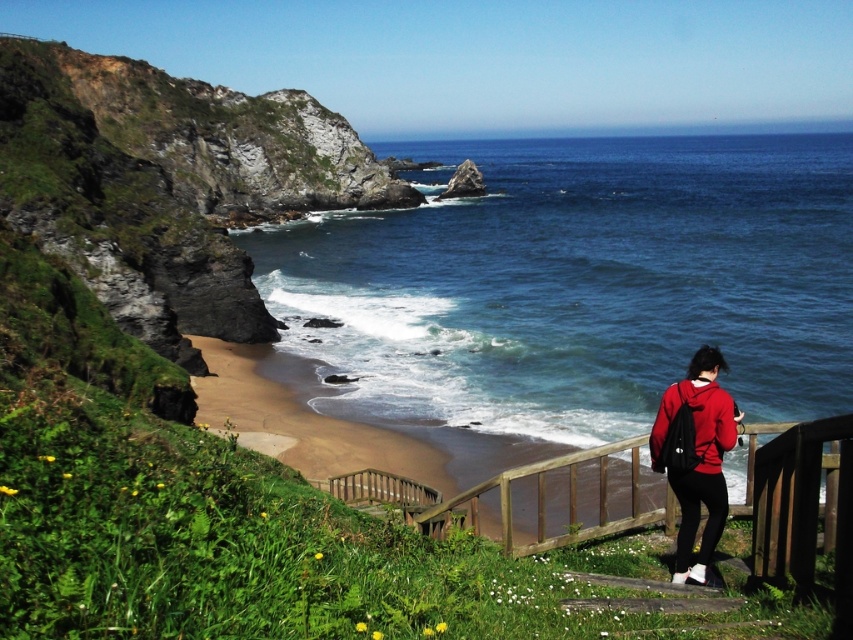
Question: Does wooden at lower right appear on the left side of matte red jacket at lower right?

Choices:
 (A) no
 (B) yes

Answer: (A)

Question: Does red matte jacket at lower right have a smaller size compared to wooden at lower right?

Choices:
 (A) yes
 (B) no

Answer: (A)

Question: Can you confirm if blue water at center is wider than red matte jacket at lower right?

Choices:
 (A) yes
 (B) no

Answer: (A)

Question: Among these points, which one is farthest from the camera?

Choices:
 (A) (578, 244)
 (B) (727, 504)
 (C) (527, 547)

Answer: (A)

Question: Which point is farther to the camera?

Choices:
 (A) pyautogui.click(x=712, y=420)
 (B) pyautogui.click(x=697, y=474)
 (C) pyautogui.click(x=447, y=340)
 (D) pyautogui.click(x=665, y=506)

Answer: (C)

Question: Estimate the real-world distances between objects in this image. Which object is closer to the blue water at center?

Choices:
 (A) matte red jacket at lower right
 (B) wooden at lower right
 (C) red matte jacket at lower right

Answer: (B)